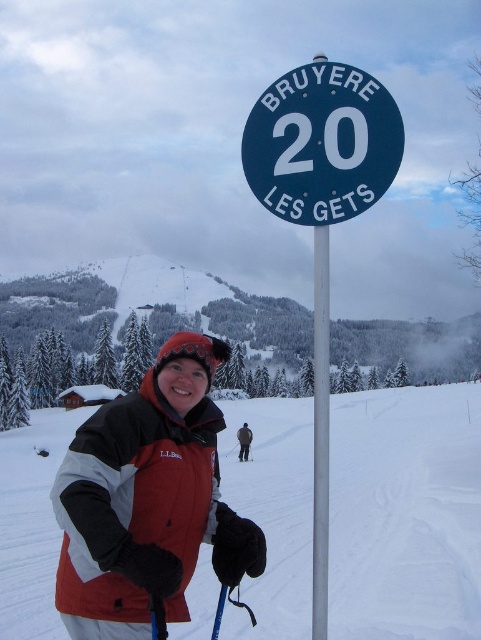
Question: Which object is the farthest from the white fluffy snow at lower center?

Choices:
 (A) red fleece jacket at center
 (B) black matte ski at center

Answer: (A)

Question: Does green metallic sign at center come behind black matte ski at center?

Choices:
 (A) yes
 (B) no

Answer: (B)

Question: Which object appears closest to the camera in this image?

Choices:
 (A) white fluffy snow at lower center
 (B) metallic pole at center
 (C) dark gray jacket at center

Answer: (B)

Question: Observing the image, what is the correct spatial positioning of white fluffy snow at lower center in reference to red fleece jacket at center?

Choices:
 (A) above
 (B) below

Answer: (B)

Question: Is red fleece jacket at center thinner than dark gray jacket at center?

Choices:
 (A) yes
 (B) no

Answer: (B)

Question: Which of the following is the closest to the observer?

Choices:
 (A) (292, 397)
 (B) (240, 458)

Answer: (B)